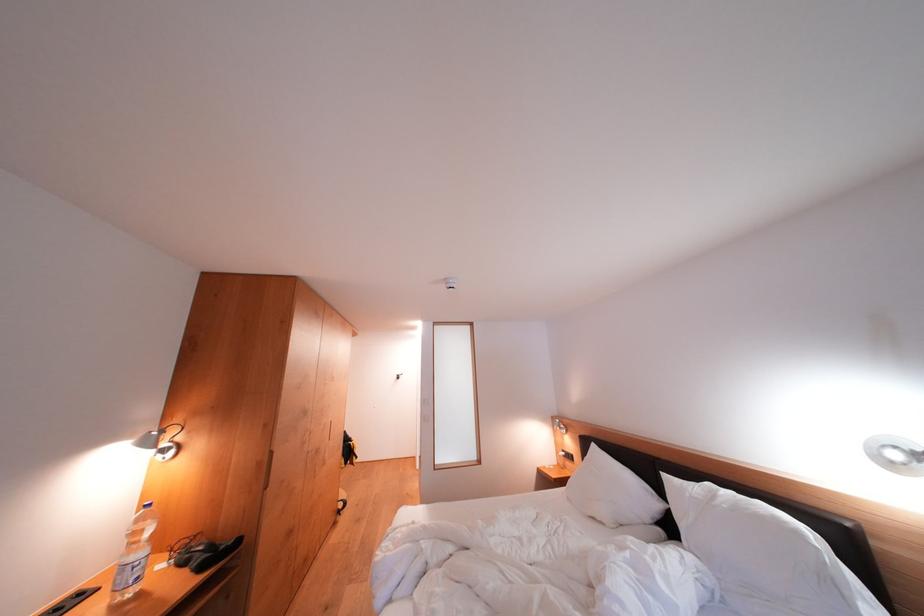
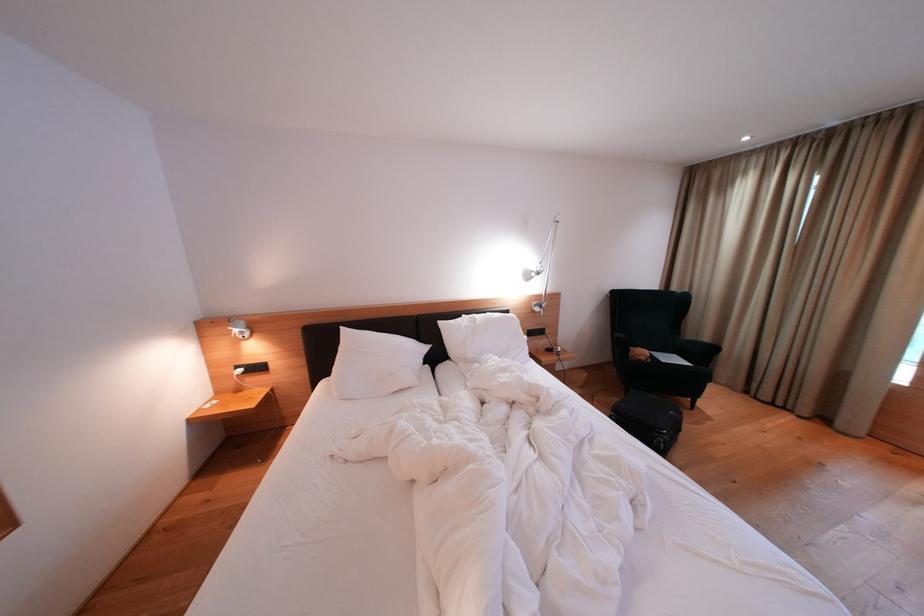
The point at (566, 432) is marked in the first image. Where is the corresponding point in the second image?

(249, 336)